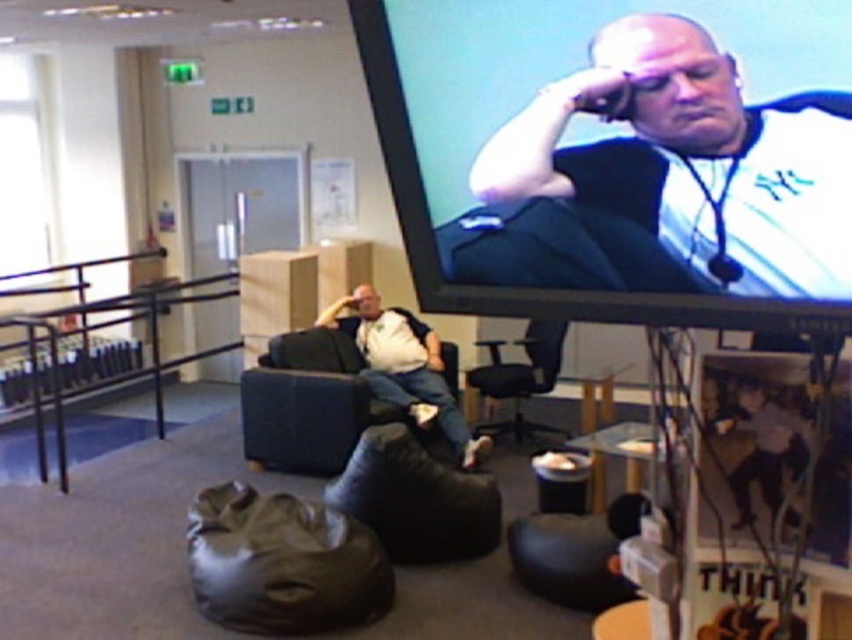
You are standing at the camera position and want to move to the black leather swivel chair at center. Is the distance between them sufficient for you to walk directly to the chair without needing to detour around any obstacles?

The distance between the black leather swivel chair at center and the camera is 4.10 meters, so yes, you can walk directly to the chair without needing to detour around any obstacles as there are no mentioned obstacles in the scene description.

You are standing in the lounge and want to grab the matte black jacket at upper right. Considering your height is 5.5 feet, can you reach it?

The matte black jacket at upper right is 4.82 feet away from the viewer, so yes, you can reach it since it is within your height of 5.5 feet.

You are standing in the lounge and want to place a small plant between the matte black jacket at upper right and the black fabric armchair at center. Can you fit it vertically between them?

The matte black jacket at upper right is above the black fabric armchair at center, so there is vertical space between them. The small plant can be placed vertically between them.